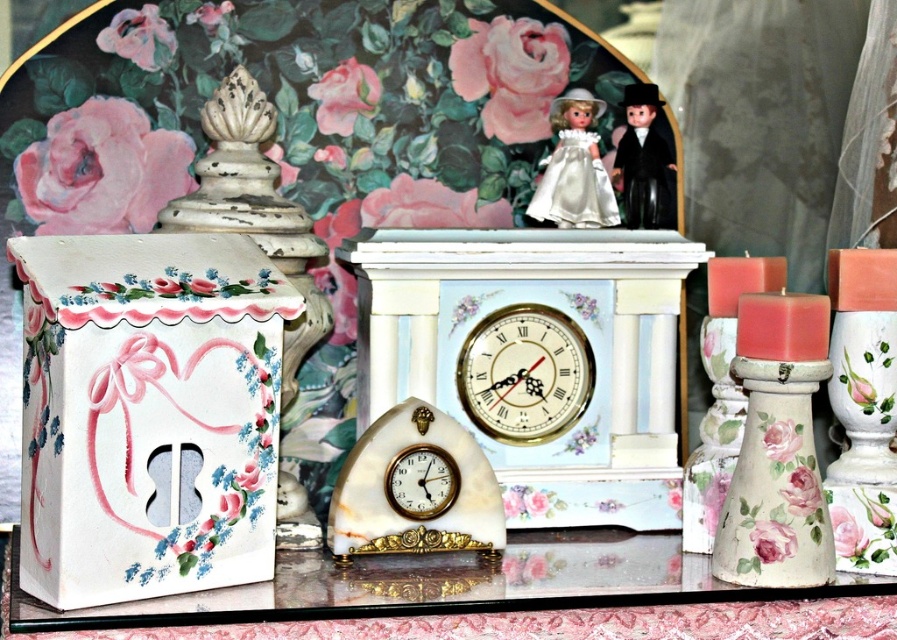
You are standing in front of the vintage decorative items displayed on the table. There is a point marked at coordinates (525, 372). Which object is located at this point?

The point at coordinates (525, 372) corresponds to the white marble clock at center.

In the scene shown: You are standing in front of the vintage decorative items displayed on the table. There are two points marked on the table surface. The first point is at coordinate point (559, 150) and the second is at point (434, 490). If you were to draw a straight line from your current position towards the first point, would it pass in front of or behind the second point?

The point at (559, 150) is behind point (434, 490). Therefore, if you draw a straight line towards the first point, it would pass behind the second point.